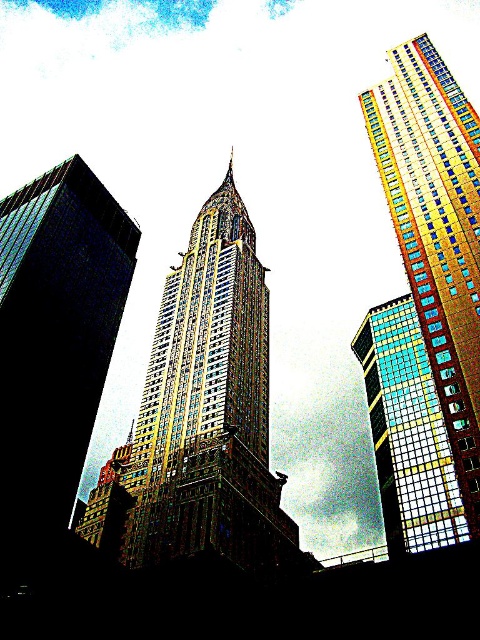
Is gold mosaic skyscraper at right thinner than multicolored glass skyscraper at center?

No.

Which is below, gold mosaic skyscraper at right or multicolored glass skyscraper at center?

multicolored glass skyscraper at center

At what (x,y) coordinates should I click in order to perform the action: click on gold mosaic skyscraper at right. Please return your answer as a coordinate pair (x, y). The image size is (480, 640). Looking at the image, I should click on (436, 230).

Is gold glass skyscraper at center positioned at the back of multicolored glass skyscraper at center?

That is True.

Does gold glass skyscraper at center have a lesser width compared to multicolored glass skyscraper at center?

Incorrect, gold glass skyscraper at center's width is not less than multicolored glass skyscraper at center's.

Describe the element at coordinates (205, 412) in the screenshot. I see `gold glass skyscraper at center` at that location.

Where is `gold glass skyscraper at center`? gold glass skyscraper at center is located at coordinates (205, 412).

Is gold glass skyscraper at center to the left of gold mosaic skyscraper at right from the viewer's perspective?

Yes, gold glass skyscraper at center is to the left of gold mosaic skyscraper at right.

Is point (207, 284) closer to camera compared to point (432, 77)?

No, it is not.

Find the location of `gold glass skyscraper at center`. gold glass skyscraper at center is located at coordinates pos(205,412).